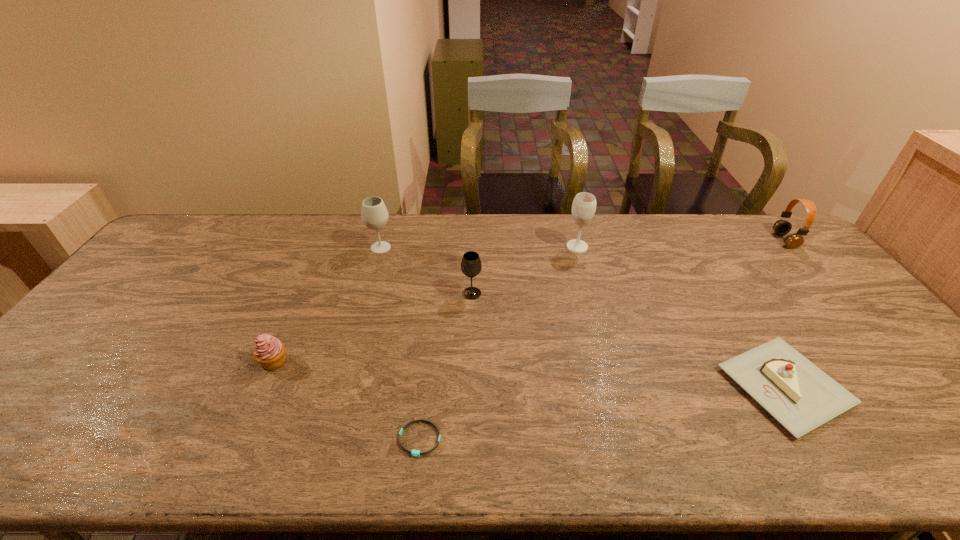
Identify the location of vacant area between the rightmost object and the shortest wineglass. (628, 267).

Locate an element on the screen. free space between the fifth object from left to right and the shortest object is located at coordinates (498, 343).

At what (x,y) coordinates should I click in order to perform the action: click on empty space between the leftmost wineglass and the second wineglass from right to left. Please return your answer as a coordinate pair (x, y). The image size is (960, 540). Looking at the image, I should click on (426, 271).

Identify the location of free spot between the fifth tallest object and the sixth tallest object. This screenshot has height=540, width=960. (529, 374).

Locate an element on the screen. free space between the cake and the leftmost wineglass is located at coordinates (583, 317).

What are the coordinates of `empty location between the rightmost object and the fifth object from left to right` in the screenshot? It's located at (681, 244).

Find the location of `free space between the shortest object and the rightmost object`. free space between the shortest object and the rightmost object is located at coordinates (602, 340).

Locate an element on the screen. object that stands as the closest to the second object from left to right is located at coordinates (471, 265).

Select which object appears as the third closest to the fifth object from left to right. Please provide its 2D coordinates. Your answer should be formatted as a tuple, i.e. [(x, y)], where the tuple contains the x and y coordinates of a point satisfying the conditions above.

[(374, 214)]

I want to click on the closest wineglass relative to the leftmost wineglass, so click(471, 265).